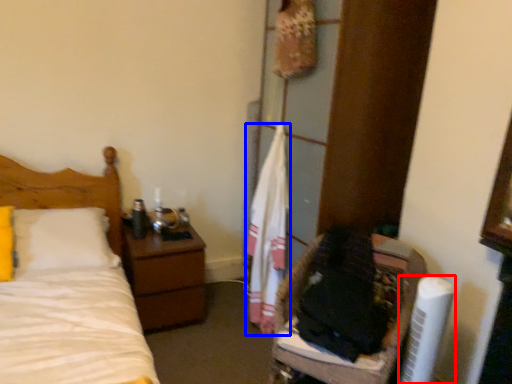
Question: Among these objects, which one is farthest to the camera, air conditioner (highlighted by a red box) or clothe (highlighted by a blue box)?

Choices:
 (A) air conditioner
 (B) clothe

Answer: (B)